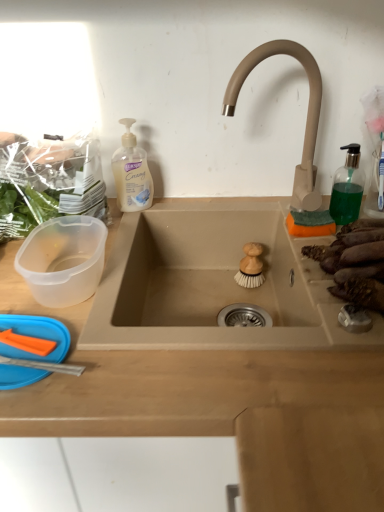
Question: Is beige matte faucet at upper right bigger than wooden brush at sink center, which is the 2th food from right to left?

Choices:
 (A) yes
 (B) no

Answer: (A)

Question: From the image's perspective, is beige matte faucet at upper right under wooden brush at sink center, which is the 2th food from right to left?

Choices:
 (A) yes
 (B) no

Answer: (B)

Question: Can you confirm if beige matte faucet at upper right is shorter than wooden brush at sink center, which is counted as the second food, starting from the left?

Choices:
 (A) no
 (B) yes

Answer: (A)

Question: Are beige matte faucet at upper right and wooden brush at sink center, which is counted as the second food, starting from the left, making contact?

Choices:
 (A) yes
 (B) no

Answer: (B)

Question: Can you confirm if beige matte faucet at upper right is wider than wooden brush at sink center, which is the 2th food from right to left?

Choices:
 (A) no
 (B) yes

Answer: (B)

Question: Is beige wood countertop at center in front of or behind brown matte sweet potatoes at right, acting as the first food starting from the right, in the image?

Choices:
 (A) behind
 (B) front

Answer: (A)

Question: Looking at the image, does beige wood countertop at center seem bigger or smaller compared to brown matte sweet potatoes at right, which is the third food from left to right?

Choices:
 (A) big
 (B) small

Answer: (A)

Question: Looking at their shapes, would you say beige wood countertop at center is wider or thinner than brown matte sweet potatoes at right, which is the third food from left to right?

Choices:
 (A) wide
 (B) thin

Answer: (A)

Question: Considering the positions of point (322, 486) and point (365, 230), is point (322, 486) closer or farther from the camera than point (365, 230)?

Choices:
 (A) farther
 (B) closer

Answer: (B)

Question: Relative to green translucent soap dispenser at right, is wooden brush at sink center, which is counted as the second food, starting from the left, in front or behind?

Choices:
 (A) behind
 (B) front

Answer: (A)

Question: Which is correct: wooden brush at sink center, which is counted as the second food, starting from the left, is inside green translucent soap dispenser at right, or outside of it?

Choices:
 (A) inside
 (B) outside

Answer: (B)

Question: In terms of height, does wooden brush at sink center, which is the 2th food from right to left, look taller or shorter compared to green translucent soap dispenser at right?

Choices:
 (A) short
 (B) tall

Answer: (A)

Question: Is wooden brush at sink center, which is the 2th food from right to left, bigger or smaller than green translucent soap dispenser at right?

Choices:
 (A) big
 (B) small

Answer: (B)

Question: Relative to white creamy liquid soap at upper left, is green leafy vegetables at left, which appears as the 1th food when viewed from the left, in front or behind?

Choices:
 (A) behind
 (B) front

Answer: (B)

Question: Is green leafy vegetables at left, which appears as the 1th food when viewed from the left, wider or thinner than white creamy liquid soap at upper left?

Choices:
 (A) wide
 (B) thin

Answer: (A)